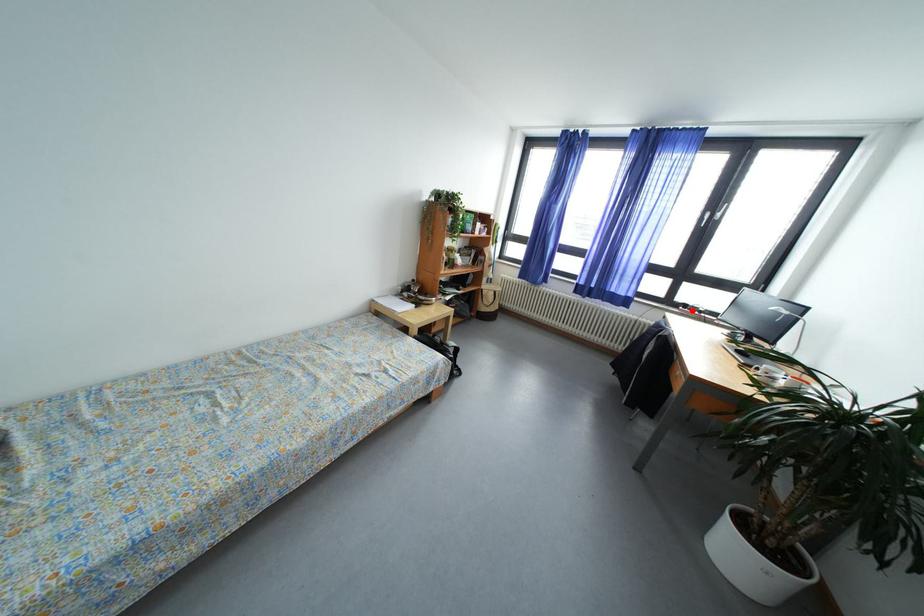
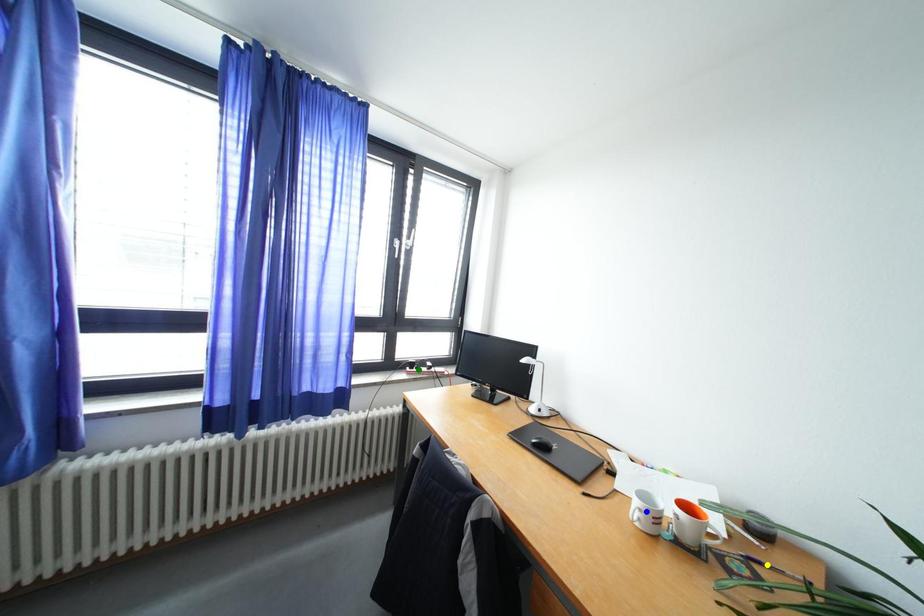
Question: I am providing you with two images of the same scene from different viewpoints. A red point is marked on the first image. You are given multiple points on the second image. Which point in image 2 is actually the same real-world point as the red point in image 1?

Choices:
 (A) yellow point
 (B) blue point
 (C) green point

Answer: (C)